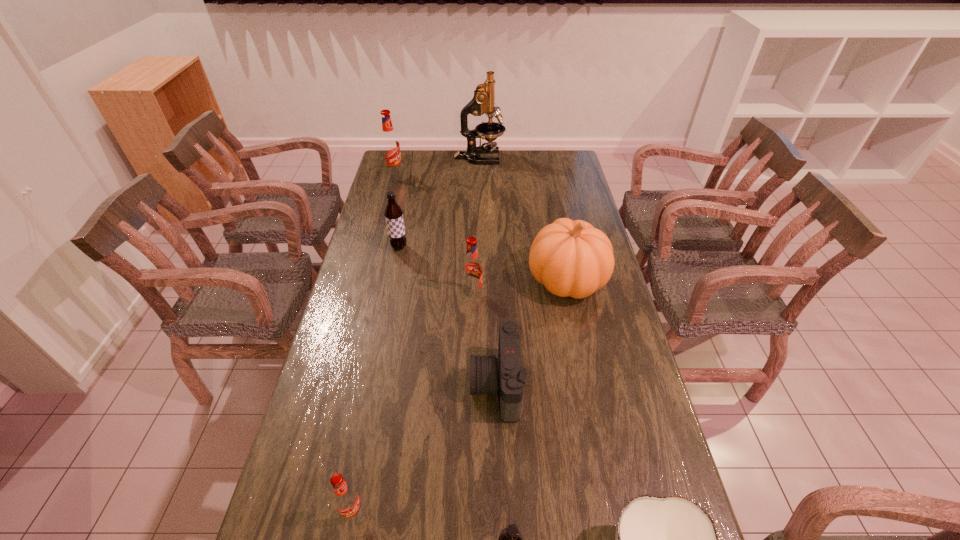
Image resolution: width=960 pixels, height=540 pixels. What are the coordinates of `vacant space in between the pumpkin and the farthest red root beer` in the screenshot? It's located at (481, 227).

You are a GUI agent. You are given a task and a screenshot of the screen. Output one action in this format:
    pyautogui.click(x=<x>, y=<y>)
    Task: Click on the vacant space that's between the smallest red root beer and the farthest red root beer
    This screenshot has width=960, height=540.
    Given the screenshot: What is the action you would take?
    pyautogui.click(x=373, y=343)

Where is `free point between the third farthest root beer and the leftmost root beer`? free point between the third farthest root beer and the leftmost root beer is located at coordinates (434, 234).

Where is `free space between the tallest object and the fourth nearest root beer`? Image resolution: width=960 pixels, height=540 pixels. free space between the tallest object and the fourth nearest root beer is located at coordinates point(440,202).

Find the location of `vacant area that lies between the leftmost root beer and the farthest object`. vacant area that lies between the leftmost root beer and the farthest object is located at coordinates (437, 166).

Image resolution: width=960 pixels, height=540 pixels. Find the location of `empty location between the orange pumpkin and the bigger brown root beer`. empty location between the orange pumpkin and the bigger brown root beer is located at coordinates (483, 264).

The width and height of the screenshot is (960, 540). I want to click on object that can be found as the fourth closest to the left brown root beer, so click(x=504, y=374).

Choose which object is the eighth nearest neighbor to the farthest root beer. Please provide its 2D coordinates. Your answer should be formatted as a tuple, i.e. [(x, y)], where the tuple contains the x and y coordinates of a point satisfying the conditions above.

[(670, 539)]

Identify the location of root beer object that ranks as the second closest to the orange pumpkin. (393, 213).

Select which root beer is the fourth closest to the tallest object. Please provide its 2D coordinates. Your answer should be formatted as a tuple, i.e. [(x, y)], where the tuple contains the x and y coordinates of a point satisfying the conditions above.

[(346, 499)]